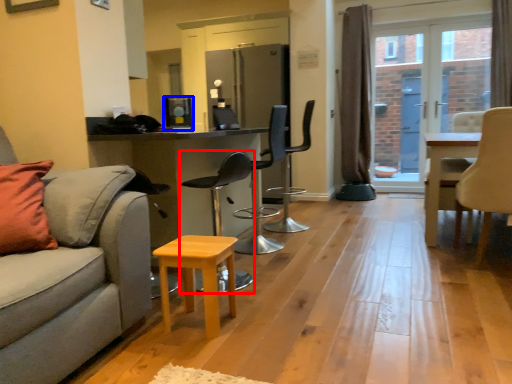
Question: Which of the following is the farthest to the observer, chair (highlighted by a red box) or appliance (highlighted by a blue box)?

Choices:
 (A) chair
 (B) appliance

Answer: (B)